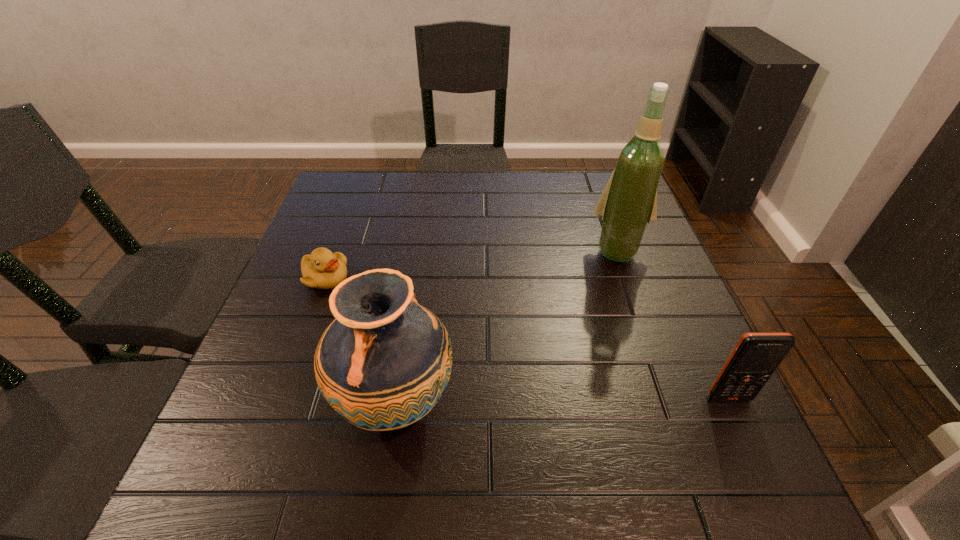
In the image, there is a desktop. At what (x,y) coordinates should I click in order to perform the action: click on free space at the near edge. Please return your answer as a coordinate pair (x, y). Looking at the image, I should click on (472, 424).

At what (x,y) coordinates should I click in order to perform the action: click on vacant space at the left edge. Please return your answer as a coordinate pair (x, y). The height and width of the screenshot is (540, 960). Looking at the image, I should click on [x=293, y=317].

The height and width of the screenshot is (540, 960). Find the location of `free spot at the right edge of the desktop`. free spot at the right edge of the desktop is located at coordinates (633, 272).

This screenshot has height=540, width=960. Identify the location of free space at the far left corner of the desktop. (344, 202).

Locate an element on the screen. This screenshot has width=960, height=540. vacant area that lies between the third tallest object and the shortest object is located at coordinates (527, 339).

The image size is (960, 540). What are the coordinates of `vacant area between the cellular telephone and the leftmost object` in the screenshot? It's located at (527, 339).

This screenshot has width=960, height=540. Identify the location of free spot between the cellular telephone and the wine bottle. (x=674, y=324).

Find the location of a particular element. This screenshot has height=540, width=960. free space between the wine bottle and the pottery is located at coordinates (507, 326).

Identify the location of free space between the tallest object and the shortest object. (472, 264).

Image resolution: width=960 pixels, height=540 pixels. What are the coordinates of `unoccupied position between the pottery and the tallest object` in the screenshot? It's located at (507, 326).